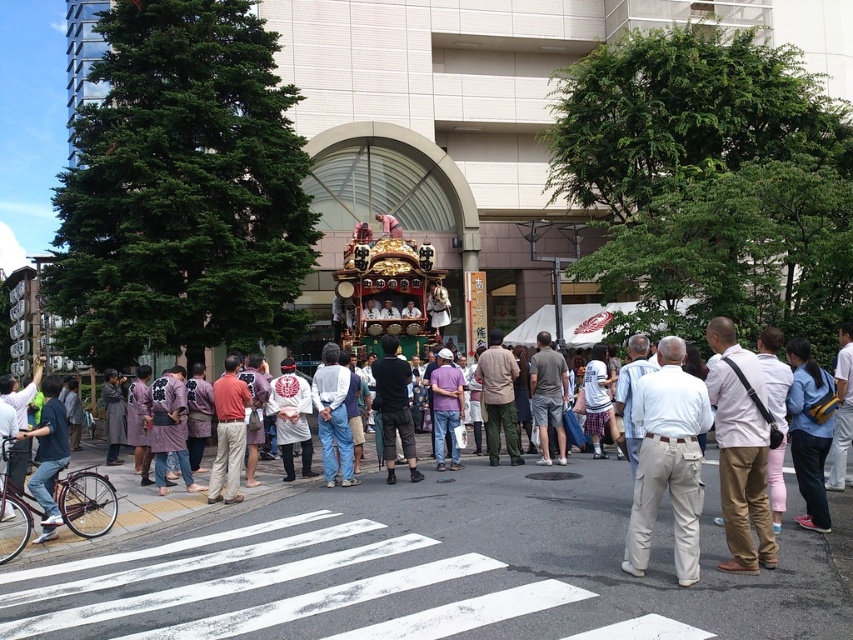
Is white painted crosswalk at center positioned at the back of denim pants at center?

No, white painted crosswalk at center is closer to the viewer.

Is white painted crosswalk at center smaller than denim pants at center?

Incorrect, white painted crosswalk at center is not smaller in size than denim pants at center.

Who is more forward, (415, 538) or (331, 467)?

Point (415, 538)

This screenshot has height=640, width=853. I want to click on white painted crosswalk at center, so click(210, 588).

Does point (242, 560) lie in front of point (392, 358)?

Yes, point (242, 560) is in front of point (392, 358).

Who is lower down, white painted crosswalk at center or black cotton pants at center?

white painted crosswalk at center is below.

Is point (21, 627) positioned in front of point (393, 384)?

Yes, it is.

Identify the location of white painted crosswalk at center. The image size is (853, 640). (210, 588).

Can you confirm if orange cotton shirt at center is positioned to the left of purple cotton shirt at center?

Correct, you'll find orange cotton shirt at center to the left of purple cotton shirt at center.

Is orange cotton shirt at center shorter than purple cotton shirt at center?

No, orange cotton shirt at center is not shorter than purple cotton shirt at center.

Measure the distance between point (233, 499) and camera.

They are 36.81 meters apart.

Image resolution: width=853 pixels, height=640 pixels. What are the coordinates of `orange cotton shirt at center` in the screenshot? It's located at (228, 433).